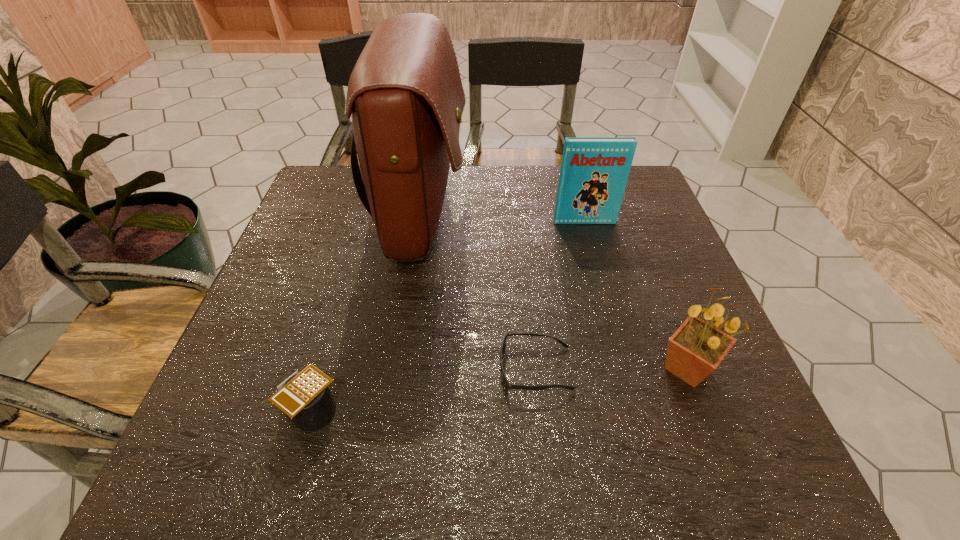
Locate an element on the screen. This screenshot has height=540, width=960. blank area at the near edge is located at coordinates (464, 470).

In the image, there is a desktop. Where is `vacant space at the left edge`? This screenshot has height=540, width=960. vacant space at the left edge is located at coordinates click(x=263, y=312).

You are a GUI agent. You are given a task and a screenshot of the screen. Output one action in this format:
    pyautogui.click(x=<x>, y=<y>)
    Task: Click on the blank space at the right edge
    The height and width of the screenshot is (540, 960).
    Given the screenshot: What is the action you would take?
    pyautogui.click(x=678, y=397)

I want to click on vacant point at the far left corner, so click(x=354, y=205).

Locate an element on the screen. This screenshot has width=960, height=540. free space at the far right corner of the desktop is located at coordinates (658, 206).

Where is `free spot between the calculator and the book`? This screenshot has height=540, width=960. free spot between the calculator and the book is located at coordinates (448, 317).

At what (x,y) coordinates should I click in order to perform the action: click on vacant area between the book and the fourth tallest object. Please return your answer as a coordinate pair (x, y). Looking at the image, I should click on (448, 317).

Where is `vacant space in between the sunglasses and the fourth tallest object`? vacant space in between the sunglasses and the fourth tallest object is located at coordinates (423, 390).

Locate an element on the screen. This screenshot has width=960, height=540. vacant region between the tallest object and the sunflower is located at coordinates (555, 293).

This screenshot has height=540, width=960. Identify the location of vacant space that is in between the third object from left to right and the satchel. (479, 293).